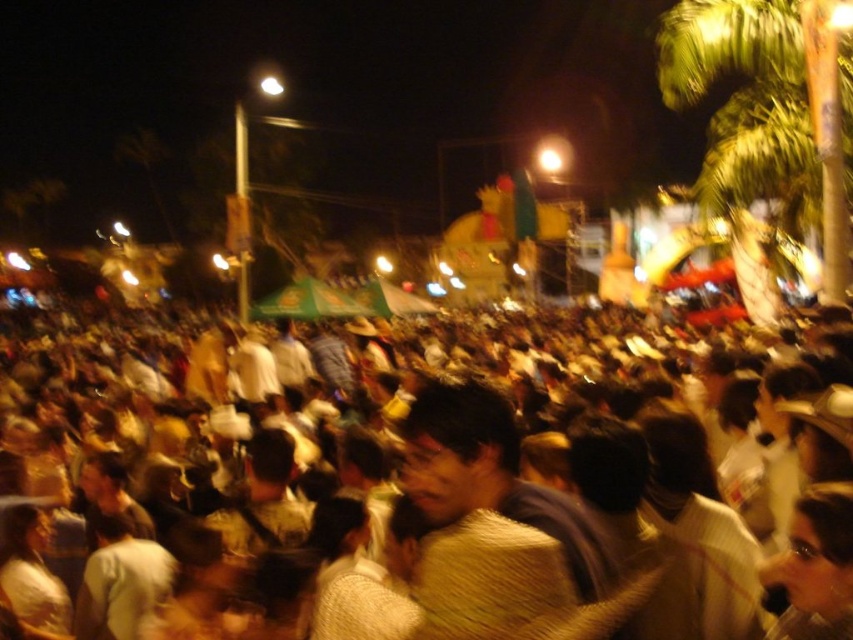
Between brown textured crowd at center and green leafy palm tree at upper right, which one appears on the right side from the viewer's perspective?

green leafy palm tree at upper right is more to the right.

Who is more distant from viewer, (10, 429) or (814, 124)?

Positioned behind is point (10, 429).

At what (x,y) coordinates should I click in order to perform the action: click on brown textured crowd at center. Please return your answer as a coordinate pair (x, y). This screenshot has width=853, height=640. Looking at the image, I should click on (113, 426).

Where is `brown textured crowd at center`? Image resolution: width=853 pixels, height=640 pixels. brown textured crowd at center is located at coordinates [x=113, y=426].